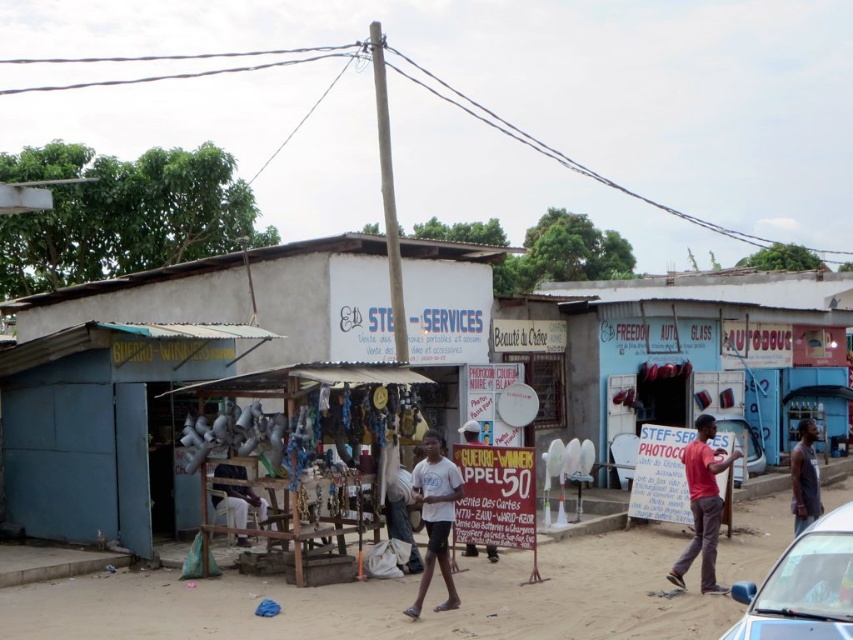
Does white cotton shirt at center have a greater height compared to white matte person at center?

Yes.

Which is behind, point (445, 504) or point (490, 547)?

The point (490, 547) is more distant.

The image size is (853, 640). I want to click on white cotton shirt at center, so click(x=434, y=516).

Based on the photo, does blue glossy car at lower right have a larger size compared to white cotton shirt at center?

Yes.

Image resolution: width=853 pixels, height=640 pixels. Describe the element at coordinates (804, 586) in the screenshot. I see `blue glossy car at lower right` at that location.

Does point (846, 618) come in front of point (453, 602)?

Yes, point (846, 618) is closer to viewer.

Locate an element on the screen. The width and height of the screenshot is (853, 640). blue glossy car at lower right is located at coordinates (804, 586).

Does blue glossy car at lower right appear on the left side of white cotton pants at center?

Incorrect, blue glossy car at lower right is not on the left side of white cotton pants at center.

Does blue glossy car at lower right have a greater width compared to white cotton pants at center?

Indeed, blue glossy car at lower right has a greater width compared to white cotton pants at center.

Between point (791, 637) and point (221, 515), which one is positioned behind?

The point (221, 515) is behind.

The height and width of the screenshot is (640, 853). In order to click on blue glossy car at lower right in this screenshot , I will do `click(804, 586)`.